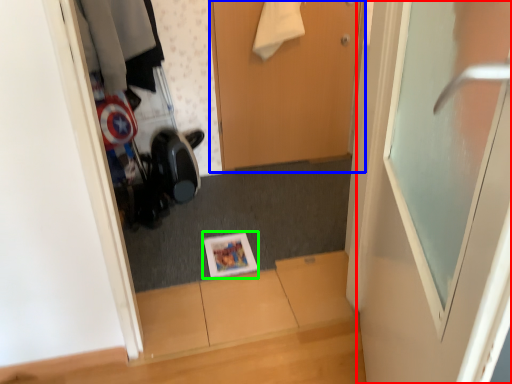
Question: Estimate the real-world distances between objects in this image. Which object is closer to door (highlighted by a red box), door (highlighted by a blue box) or magazine (highlighted by a green box)?

Choices:
 (A) door
 (B) magazine

Answer: (B)